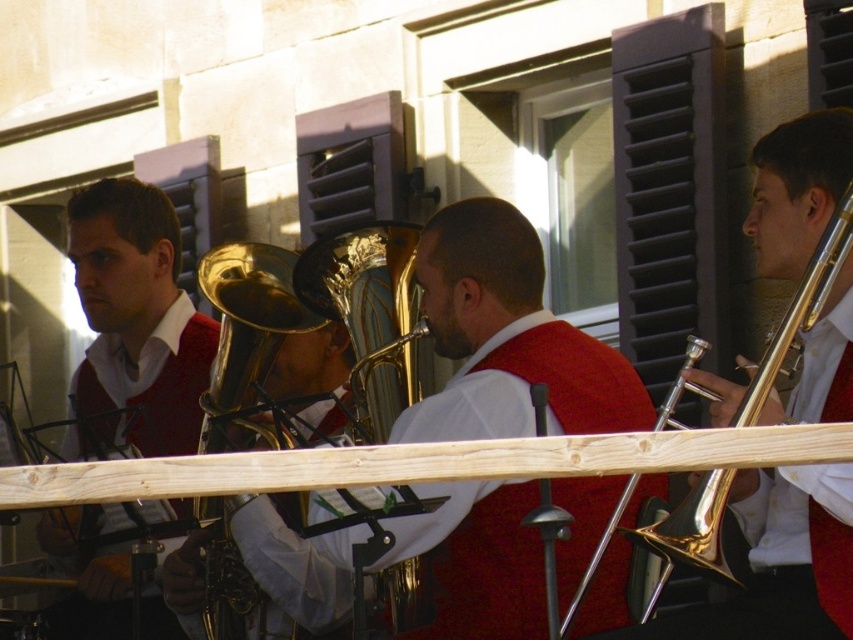
Is shiny gold tuba at center below gold shiny trumpet at right?

Yes, shiny gold tuba at center is below gold shiny trumpet at right.

Is point (462, 545) positioned before point (836, 259)?

No, (462, 545) is further to viewer.

In order to click on shiny gold tuba at center in this screenshot , I will do `click(508, 339)`.

Can you confirm if shiny gold tuba at center is taller than matte red sweater at left?

No.

Does shiny gold tuba at center have a greater width compared to matte red sweater at left?

Incorrect, shiny gold tuba at center's width does not surpass matte red sweater at left's.

Does point (467, 260) lie in front of point (129, 336)?

Yes, it is in front of point (129, 336).

Locate an element on the screen. The height and width of the screenshot is (640, 853). shiny gold tuba at center is located at coordinates (508, 339).

Consider the image. Does shiny gold tuba at center have a lesser width compared to gold shiny trumpet at center?

Yes, shiny gold tuba at center is thinner than gold shiny trumpet at center.

You are a GUI agent. You are given a task and a screenshot of the screen. Output one action in this format:
    pyautogui.click(x=<x>, y=<y>)
    Task: Click on the shiny gold tuba at center
    The image size is (853, 640).
    Given the screenshot: What is the action you would take?
    pyautogui.click(x=508, y=339)